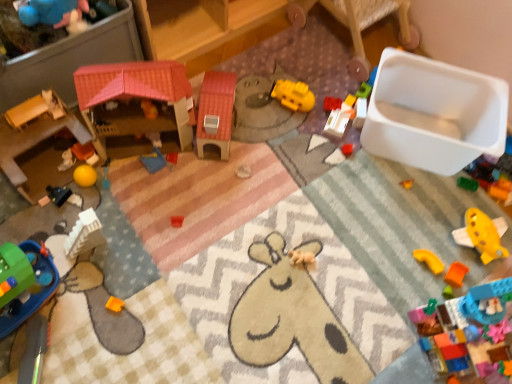
This screenshot has height=384, width=512. What are the coordinates of `vacant area that lies between yellow matte plastic toy at center, which is the 8th toy from right to left, and white plastic container at center, marked as the 6th toy in a right-to-left arrangement` in the screenshot? It's located at (316, 119).